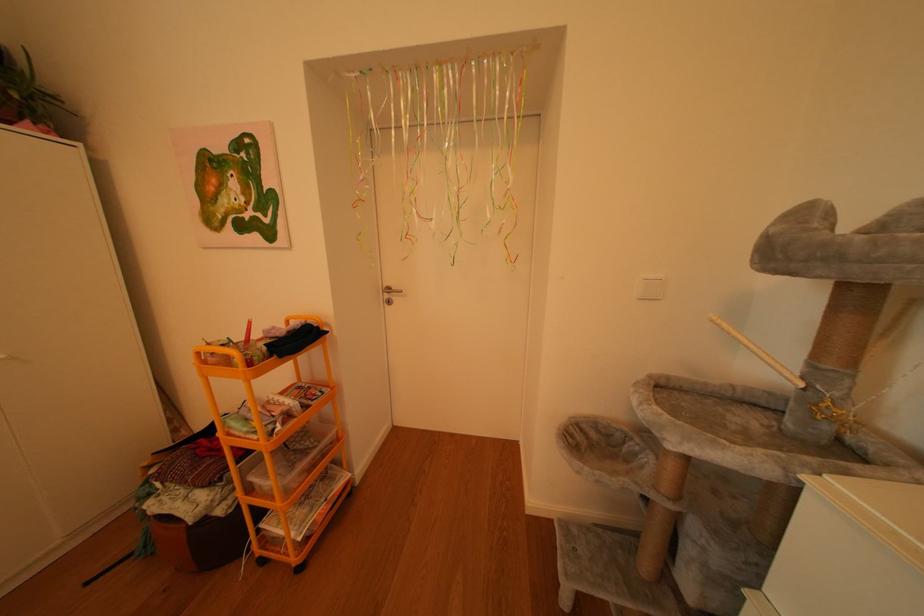
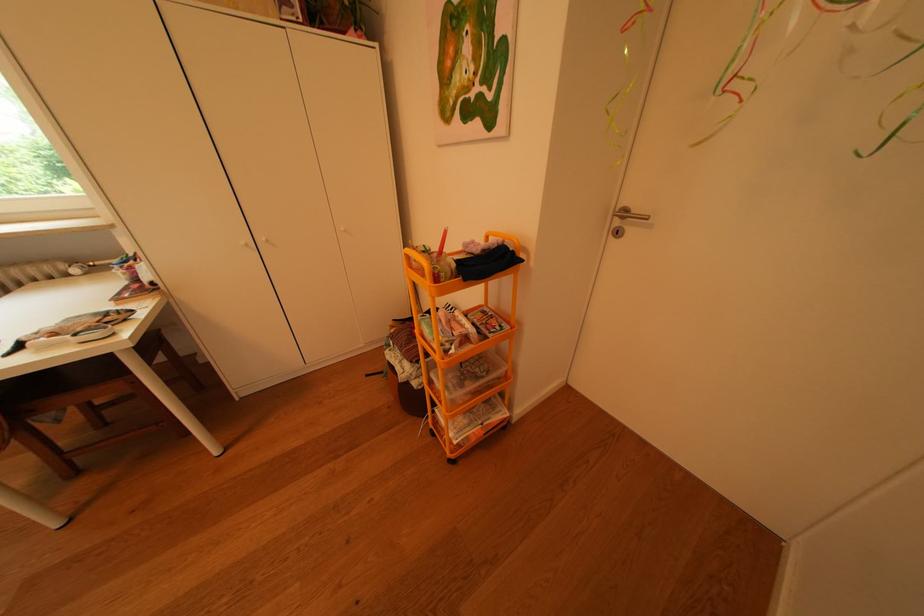
How did the camera likely rotate?

The camera rotated toward left-down.